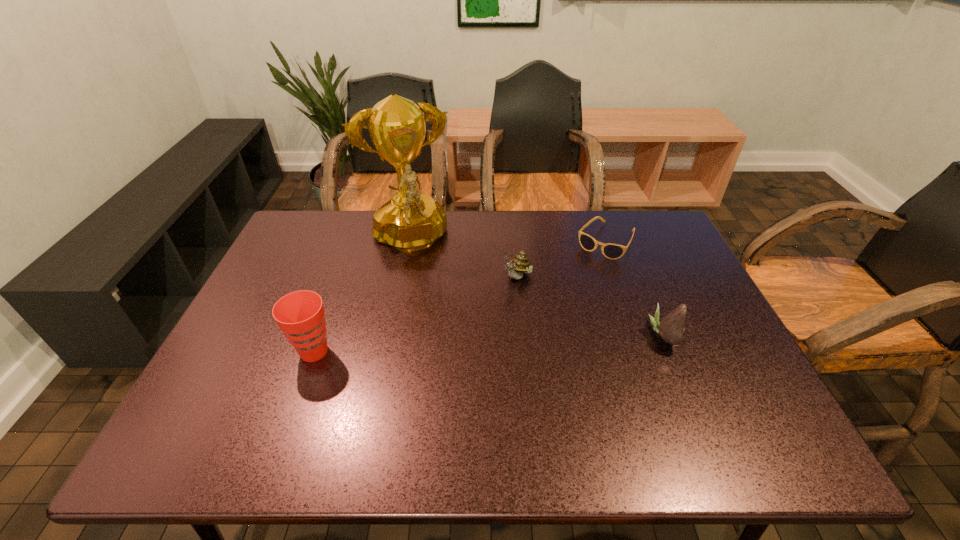
This screenshot has width=960, height=540. In order to click on free space located on the front-facing side of the sunglasses in this screenshot , I will do `click(579, 278)`.

I want to click on vacant area situated 0.330m on the front-facing side of the sunglasses, so click(544, 325).

Locate an element on the screen. The width and height of the screenshot is (960, 540). free space located 0.160m on the front-facing side of the sunglasses is located at coordinates (572, 287).

Locate an element on the screen. The height and width of the screenshot is (540, 960). free space located 0.050m on the face of the snail is located at coordinates (501, 300).

The image size is (960, 540). In order to click on free spot located 0.360m on the face of the snail in this screenshot , I will do `click(434, 380)`.

Identify the location of vacant region located on the face of the snail. (456, 354).

This screenshot has height=540, width=960. Identify the location of award located at the far edge. (410, 221).

You are a GUI agent. You are given a task and a screenshot of the screen. Output one action in this format:
    pyautogui.click(x=<x>, y=<y>)
    Task: Click on the sunglasses situated at the far edge
    
    Given the screenshot: What is the action you would take?
    pyautogui.click(x=611, y=251)

In order to click on avocado located in the right edge section of the desktop in this screenshot , I will do `click(671, 328)`.

Locate an element on the screen. sunglasses located in the right edge section of the desktop is located at coordinates (611, 251).